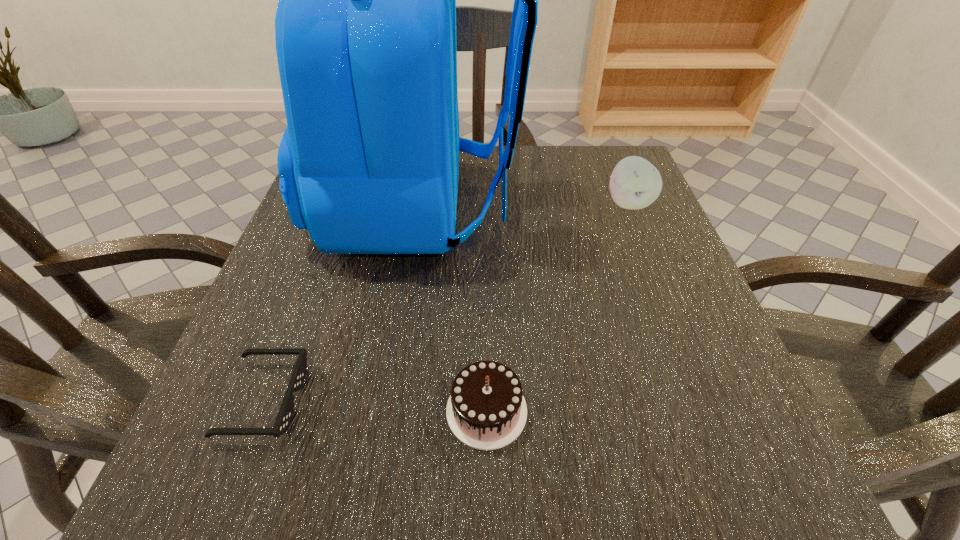
In the image, there is a desktop. Find the location of `vacant space at the near edge`. vacant space at the near edge is located at coordinates (578, 482).

The height and width of the screenshot is (540, 960). Identify the location of vacant space at the left edge of the desktop. (309, 308).

The width and height of the screenshot is (960, 540). I want to click on free spot at the right edge of the desktop, so click(x=694, y=426).

Image resolution: width=960 pixels, height=540 pixels. Identify the location of free space between the sunglasses and the apple. (446, 301).

Identify the location of unoccupied position between the second shortest object and the rightmost object. (558, 307).

This screenshot has width=960, height=540. In order to click on empty space that is in between the shortest object and the backpack in this screenshot , I will do click(342, 304).

What are the coordinates of `free space between the apple and the chocolate cake` in the screenshot? It's located at (x=558, y=307).

Image resolution: width=960 pixels, height=540 pixels. Identify the location of free area in between the second shortest object and the sunglasses. [375, 405].

I want to click on vacant area between the chocolate cake and the apple, so click(558, 307).

At what (x,y) coordinates should I click in order to perform the action: click on vacant space that's between the shortest object and the third tallest object. Please return your answer as a coordinate pair (x, y). Looking at the image, I should click on (375, 405).